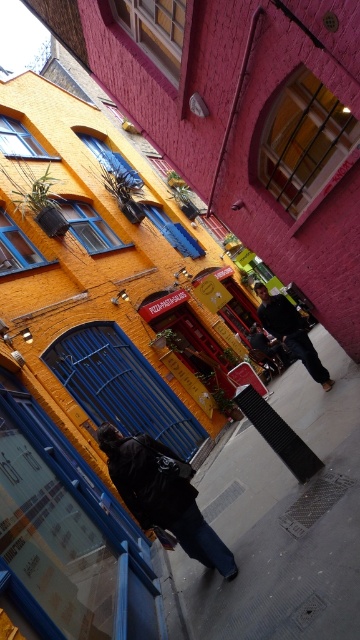
Question: Considering the relative positions of concrete sidewalk at center and dark blue jacket at lower left in the image provided, where is concrete sidewalk at center located with respect to dark blue jacket at lower left?

Choices:
 (A) right
 (B) left

Answer: (A)

Question: Is dark blue jacket at lower left bigger than dark blue jeans at center?

Choices:
 (A) no
 (B) yes

Answer: (B)

Question: Which object is the farthest from the concrete sidewalk at center?

Choices:
 (A) dark blue jeans at center
 (B) dark blue jacket at lower left

Answer: (A)

Question: Is concrete sidewalk at center above dark blue jeans at center?

Choices:
 (A) yes
 (B) no

Answer: (B)

Question: Estimate the real-world distances between objects in this image. Which object is closer to the concrete sidewalk at center?

Choices:
 (A) dark blue jacket at lower left
 (B) dark blue jeans at center

Answer: (A)

Question: Among these objects, which one is nearest to the camera?

Choices:
 (A) dark blue jacket at lower left
 (B) concrete sidewalk at center

Answer: (B)